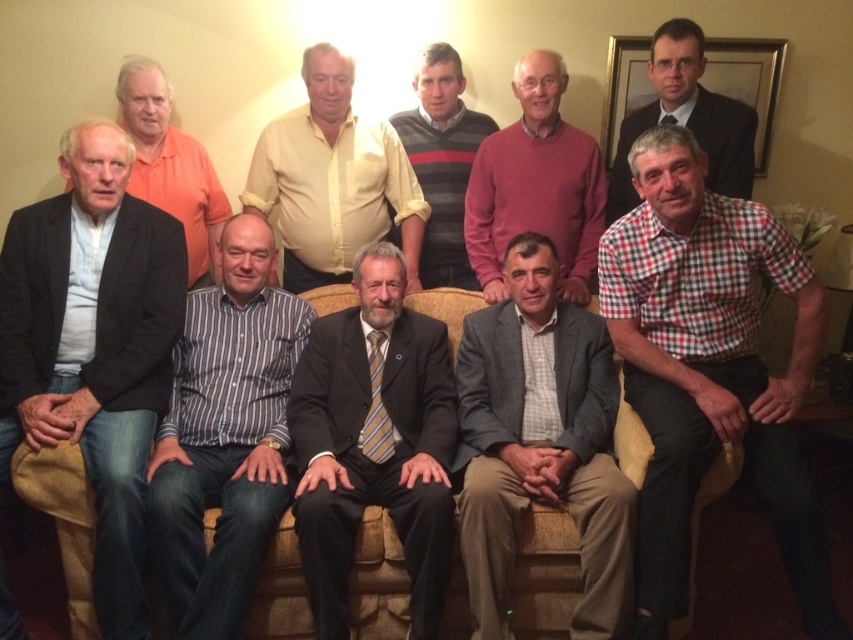
Is pink sweater at upper center smaller than white shirt at left?

Incorrect, pink sweater at upper center is not smaller in size than white shirt at left.

Does pink sweater at upper center have a larger size compared to white shirt at left?

Yes.

This screenshot has height=640, width=853. What do you see at coordinates (537, 184) in the screenshot?
I see `pink sweater at upper center` at bounding box center [537, 184].

Find the location of a particular element. This screenshot has width=853, height=640. pink sweater at upper center is located at coordinates (537, 184).

Can you confirm if gray wool suit at center is wider than formal suit at upper right?

Yes.

Which is below, gray wool suit at center or formal suit at upper right?

gray wool suit at center

Locate an element on the screen. This screenshot has width=853, height=640. gray wool suit at center is located at coordinates (540, 442).

Is point (292, 156) positioned in front of point (509, 177)?

Yes, point (292, 156) is closer to viewer.

Can you confirm if yellow cotton shirt at upper center is smaller than pink sweater at upper center?

Actually, yellow cotton shirt at upper center might be larger than pink sweater at upper center.

You are a GUI agent. You are given a task and a screenshot of the screen. Output one action in this format:
    pyautogui.click(x=<x>, y=<y>)
    Task: Click on the yellow cotton shirt at upper center
    This screenshot has width=853, height=640.
    Given the screenshot: What is the action you would take?
    pyautogui.click(x=332, y=179)